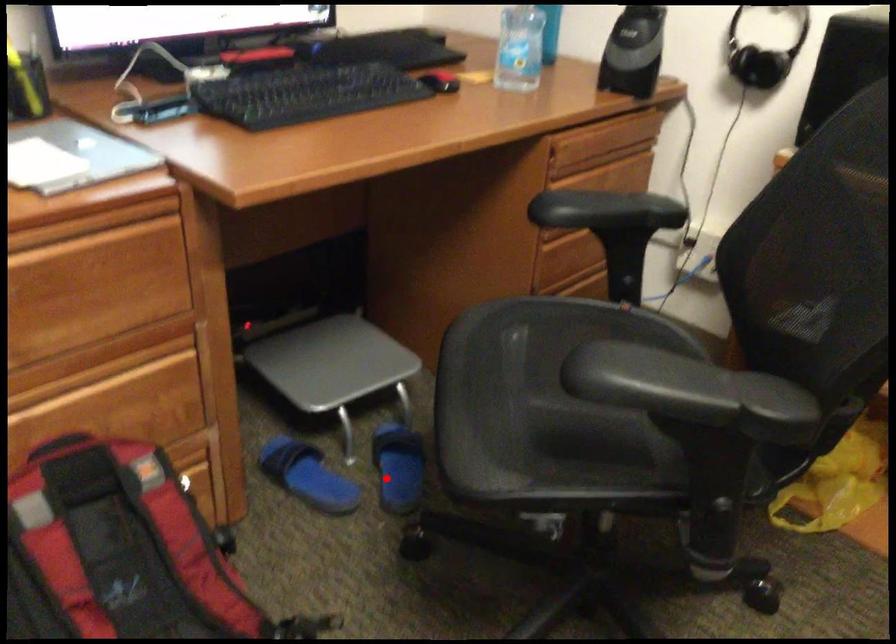
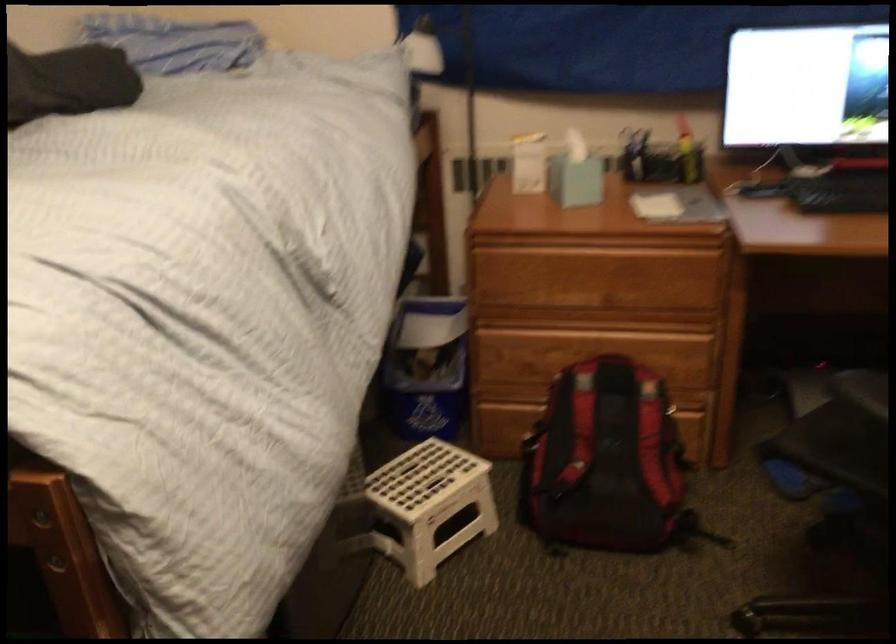
Find the pixel in the second image that matches the highlighted location in the first image.

(833, 495)